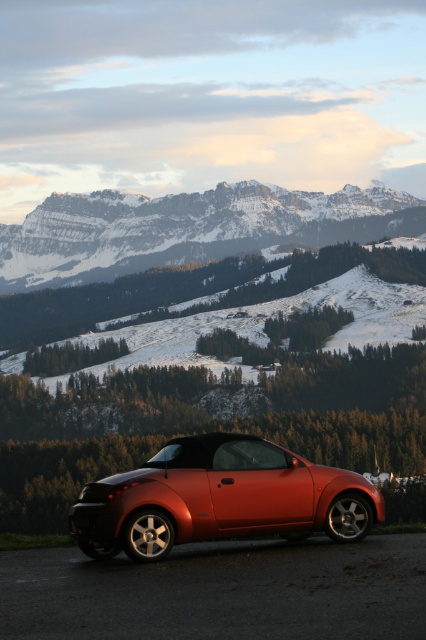
Between snowy rocky mountain at upper center and shiny metallic car at center, which one has less height?

With less height is shiny metallic car at center.

Based on the photo, does snowy rocky mountain at upper center have a smaller size compared to shiny metallic car at center?

No, snowy rocky mountain at upper center is not smaller than shiny metallic car at center.

Is point (58, 240) closer to camera compared to point (316, 472)?

No, (58, 240) is further to viewer.

Locate an element on the screen. Image resolution: width=426 pixels, height=640 pixels. snowy rocky mountain at upper center is located at coordinates (187, 228).